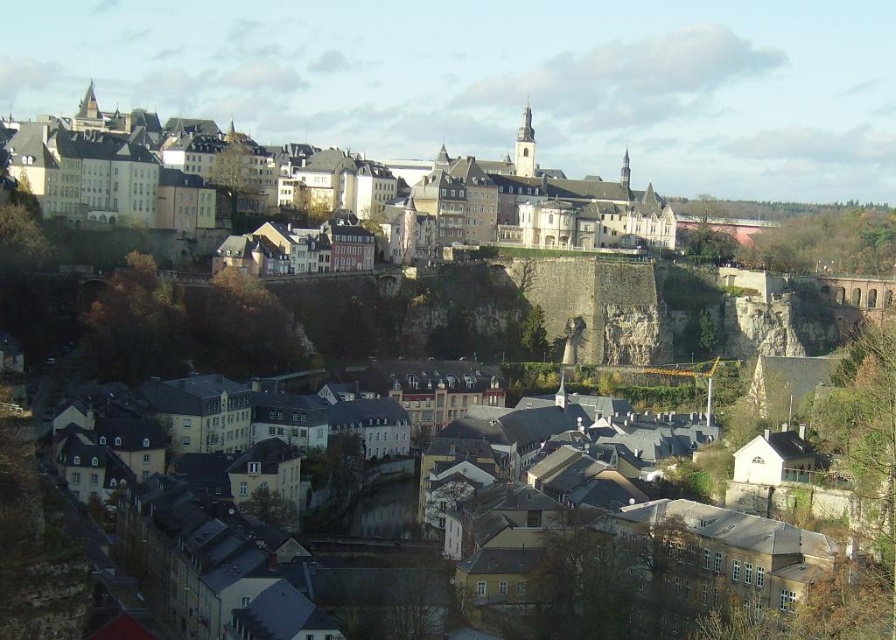
You are a tourist standing at the base of the cliff, looking up at the historic town. You notice the matte stone castle at upper left and the yellow stone buildings at center. How far apart are these two landmarks from each other?

The matte stone castle at upper left is 83.62 meters from the yellow stone buildings at center.

You are a tourist standing at the base of the cliff looking up at the historic town. You notice the matte stone castle at upper left and the yellow stone buildings at center. Which structure appears taller from your vantage point?

The matte stone castle at upper left appears taller than the yellow stone buildings at center because it has a greater height compared to them.

You are standing at the base of the cliff in the lower residential area of the historic town. You notice a point marked at coordinates (x=330, y=188). What significant structure does this point indicate?

The point marked at coordinates 0.299, 0.369 indicates the location of the matte stone castle at upper left.